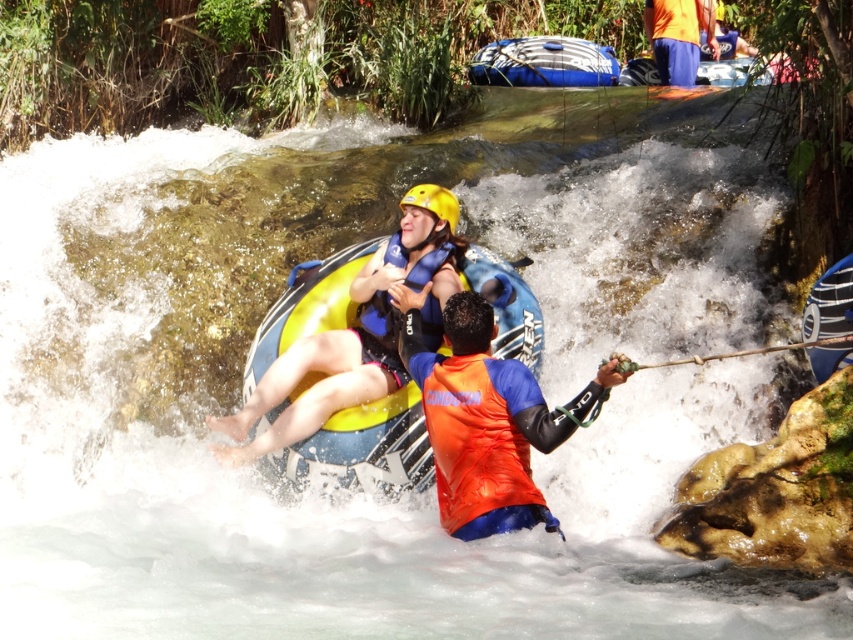
Between blue rubber kayak at upper center and yellow matte helmet at upper center, which one appears on the left side from the viewer's perspective?

Positioned to the left is yellow matte helmet at upper center.

Can you confirm if blue rubber kayak at upper center is positioned to the right of yellow matte helmet at upper center?

Indeed, blue rubber kayak at upper center is positioned on the right side of yellow matte helmet at upper center.

Is point (526, 51) farther from viewer compared to point (438, 209)?

That is True.

This screenshot has height=640, width=853. In order to click on blue rubber kayak at upper center in this screenshot , I will do `click(544, 61)`.

Can you confirm if orange fabric life jacket at center is shorter than wooden paddle at center?

Incorrect, orange fabric life jacket at center's height does not fall short of wooden paddle at center's.

Is orange fabric life jacket at center thinner than wooden paddle at center?

Indeed, orange fabric life jacket at center has a lesser width compared to wooden paddle at center.

Does point (496, 470) come behind point (689, 356)?

No, it is in front of (689, 356).

At what (x,y) coordinates should I click in order to perform the action: click on orange fabric life jacket at center. Please return your answer as a coordinate pair (x, y). Looking at the image, I should click on (477, 433).

Which of these two, orange waterproof vest at center or blue/neoprene life jacket at center, stands shorter?

With less height is blue/neoprene life jacket at center.

Identify the location of orange waterproof vest at center. (486, 420).